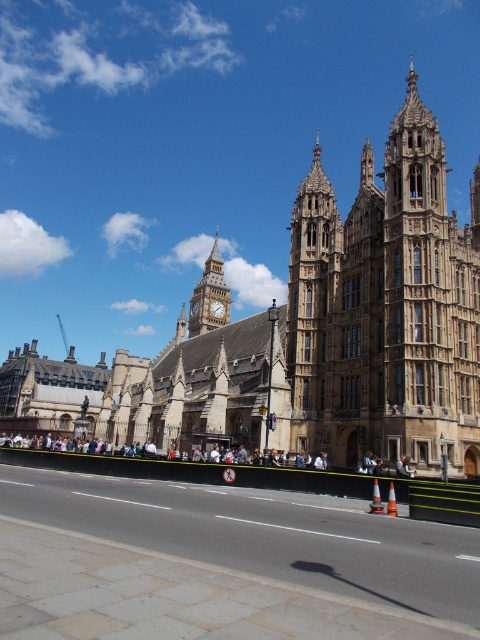
You are standing on the sidewalk near the Palace of Westminster and want to take a photo that includes both the point at coordinates [444,198] and the point at coordinates [228,291]. Which point should you position closer to the camera to ensure both are in focus?

You should position the point at coordinates [444,198] closer to the camera because it is closer to the viewer than the point at coordinates [228,291]. This ensures both points are within the depth of field and in focus.

You are a tourist standing on the sidewalk next to the brown stone tower at center. You want to walk to the brown stone building at center. Which direction should you walk to get there?

The brown stone building at center is wider than the brown stone tower at center, so you should walk towards the direction where the wider structure is located, which is the brown stone building at center.